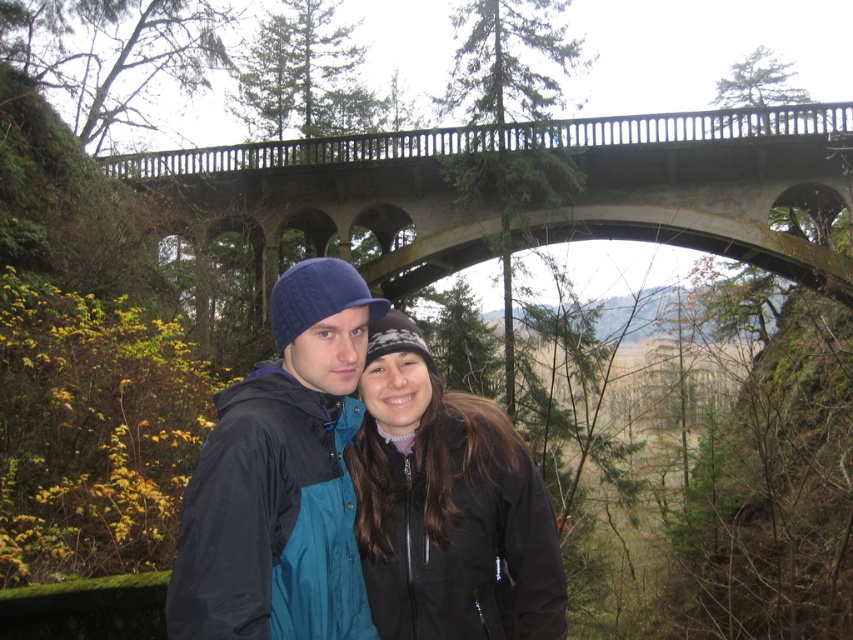
Based on the photo, you are taking a photo of the two people in the scene. You want to focus on the person closer to the camera. Which of the two points, point (194,198) or point (322,324), should you focus on?

Point (194,198) is further to the camera than point (322,324), so you should focus on point (194,198).

You are a photographer planning to take a photo of the concrete bridge at upper center and the black softshell jacket at center. Since you want to ensure both are visible in the frame, can you determine if the bridge is wider than the jacket?

The concrete bridge at upper center is wider than the black softshell jacket at center because its width surpasses the jacket.